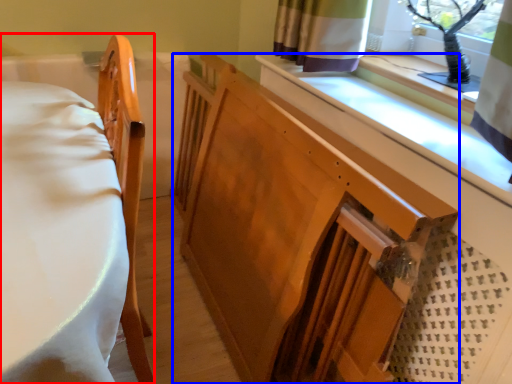
Question: Which point is closer to the camera, furniture (highlighted by a red box) or changing table (highlighted by a blue box)?

Choices:
 (A) furniture
 (B) changing table

Answer: (A)